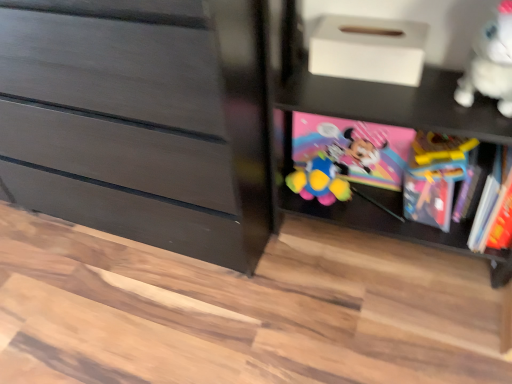
Question: Is the position of matte black dresser at left more distant than that of white plush toy at upper right?

Choices:
 (A) no
 (B) yes

Answer: (A)

Question: From a real-world perspective, is matte black dresser at left located higher than white plush toy at upper right?

Choices:
 (A) no
 (B) yes

Answer: (A)

Question: Does matte black dresser at left lie in front of white plush toy at upper right?

Choices:
 (A) yes
 (B) no

Answer: (A)

Question: Is white plush toy at upper right located within matte black dresser at left?

Choices:
 (A) yes
 (B) no

Answer: (B)

Question: Considering the relative sizes of matte black dresser at left and white plush toy at upper right in the image provided, is matte black dresser at left wider than white plush toy at upper right?

Choices:
 (A) no
 (B) yes

Answer: (B)

Question: In the image, is pink matte minnie mouse book at center, arranged as the second book when viewed from the right, positioned in front of or behind matte black dresser at left?

Choices:
 (A) front
 (B) behind

Answer: (B)

Question: From a real-world perspective, is pink matte minnie mouse book at center, which is the first book from left to right, physically located above or below matte black dresser at left?

Choices:
 (A) below
 (B) above

Answer: (A)

Question: Considering the positions of pink matte minnie mouse book at center, which is the first book from left to right, and matte black dresser at left in the image, is pink matte minnie mouse book at center, which is the first book from left to right, bigger or smaller than matte black dresser at left?

Choices:
 (A) big
 (B) small

Answer: (B)

Question: From the image's perspective, is pink matte minnie mouse book at center, which is the first book from left to right, located above or below matte black dresser at left?

Choices:
 (A) above
 (B) below

Answer: (B)

Question: Looking at their shapes, would you say white plush toy at upper right is wider or thinner than black matte shelf at lower right?

Choices:
 (A) thin
 (B) wide

Answer: (A)

Question: From the image's perspective, is white plush toy at upper right located above or below black matte shelf at lower right?

Choices:
 (A) below
 (B) above

Answer: (B)

Question: Is white plush toy at upper right in front of or behind black matte shelf at lower right in the image?

Choices:
 (A) front
 (B) behind

Answer: (B)

Question: Considering the positions of point (509, 71) and point (504, 122), is point (509, 71) closer or farther from the camera than point (504, 122)?

Choices:
 (A) closer
 (B) farther

Answer: (A)

Question: Visually, is black matte shelf at lower right positioned to the left or to the right of pink matte minnie mouse book at center, which is the first book from left to right?

Choices:
 (A) left
 (B) right

Answer: (B)

Question: In the image, is black matte shelf at lower right positioned in front of or behind pink matte minnie mouse book at center, which is the first book from left to right?

Choices:
 (A) behind
 (B) front

Answer: (B)